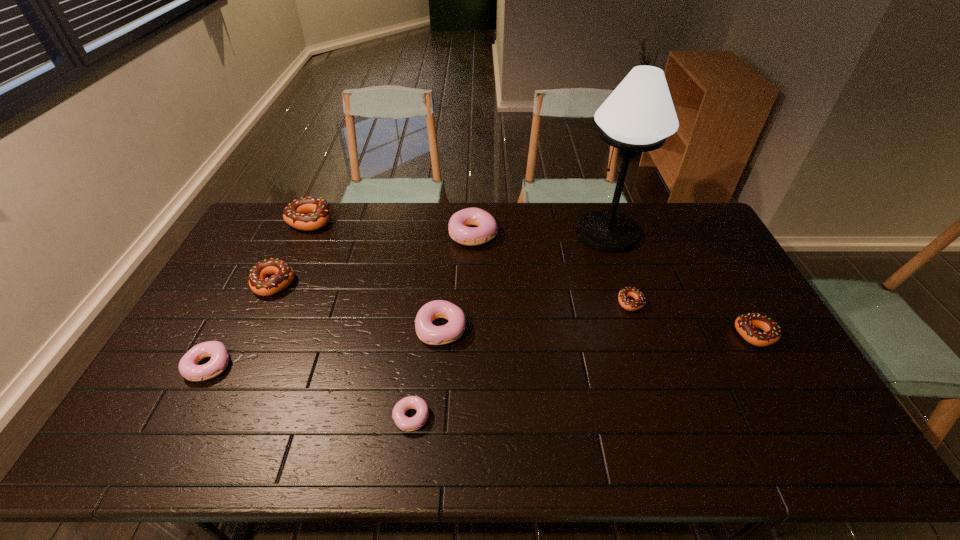
You are a GUI agent. You are given a task and a screenshot of the screen. Output one action in this format:
    pyautogui.click(x=<x>, y=<y>)
    Task: Click on the free space located 0.240m on the front of the third brown doughnut from left to right
    This screenshot has width=960, height=540.
    Given the screenshot: What is the action you would take?
    pyautogui.click(x=657, y=381)

Find the location of `free space located 0.380m on the left of the nearest object`. free space located 0.380m on the left of the nearest object is located at coordinates (240, 417).

Locate an element on the screen. The height and width of the screenshot is (540, 960). table lamp that is at the far edge is located at coordinates (639, 114).

Identify the location of object that is at the near edge. The width and height of the screenshot is (960, 540). (405, 423).

In order to click on object that is at the right edge in this screenshot , I will do `click(745, 324)`.

In order to click on object that is at the far left corner in this screenshot , I will do `click(296, 215)`.

The image size is (960, 540). In the image, there is a desktop. Identify the location of vacant space at the far edge. (598, 207).

The width and height of the screenshot is (960, 540). What are the coordinates of `vacant region at the left edge of the desktop` in the screenshot? It's located at (218, 315).

In the image, there is a desktop. Where is `vacant space at the right edge`? vacant space at the right edge is located at coordinates (779, 399).

I want to click on vacant space at the far left corner of the desktop, so click(270, 201).